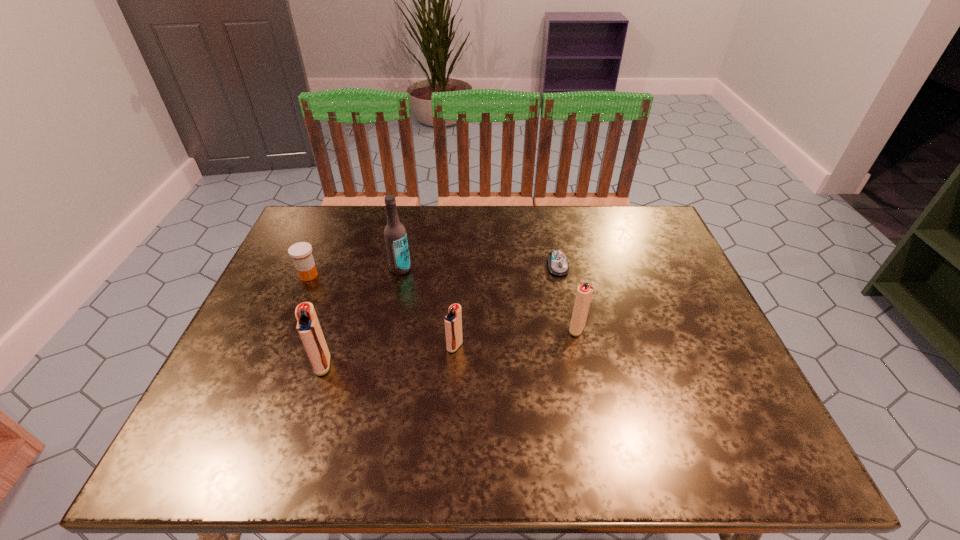
With all igniters evenly spaced, where should an extra igniter be placed on the right to continue the pattern? Please point out a vacant space. Please provide its 2D coordinates. Your answer should be formatted as a tuple, i.e. [(x, y)], where the tuple contains the x and y coordinates of a point satisfying the conditions above.

[(690, 313)]